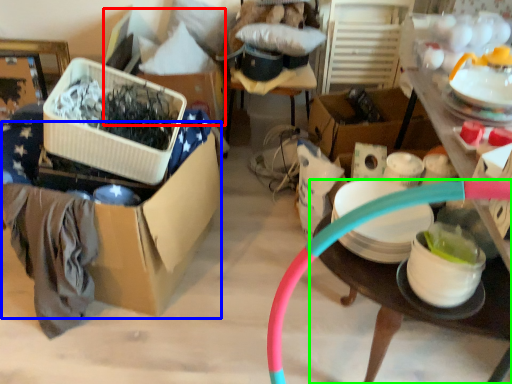
Question: Estimate the real-world distances between objects in this image. Which object is farther from storage box (highlighted by a red box), storage box (highlighted by a blue box) or table (highlighted by a green box)?

Choices:
 (A) storage box
 (B) table

Answer: (B)